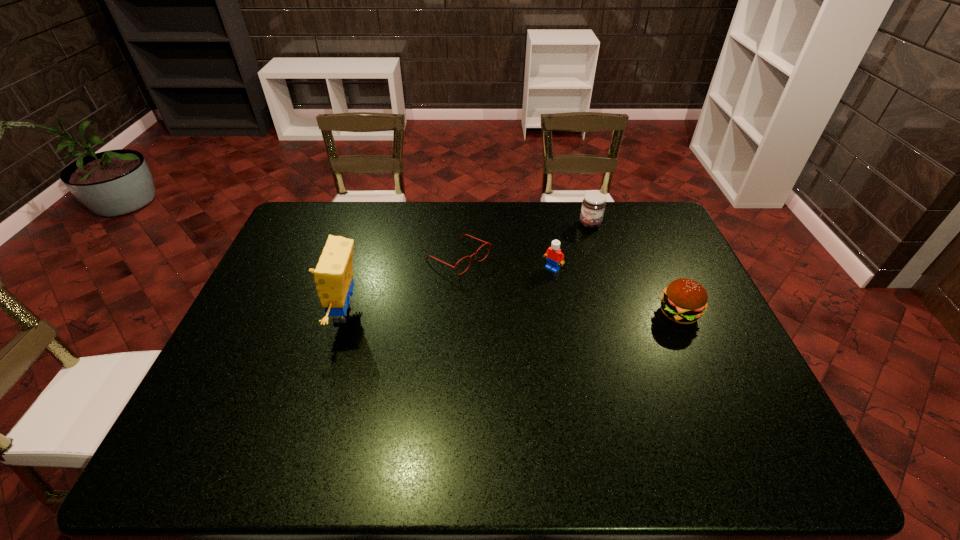
In order to click on free space located 0.350m on the face of the Lego in this screenshot , I will do `click(475, 340)`.

Identify the location of spectacles present at the far edge. The image size is (960, 540). (489, 244).

Where is `jam located at the far edge`? This screenshot has height=540, width=960. jam located at the far edge is located at coordinates (593, 205).

Locate an element on the screen. This screenshot has height=540, width=960. object that is at the right edge is located at coordinates (684, 301).

The image size is (960, 540). Find the location of `vacant space at the far edge of the desktop`. vacant space at the far edge of the desktop is located at coordinates (511, 220).

The height and width of the screenshot is (540, 960). I want to click on vacant space at the left edge, so 238,386.

Identify the location of vacant area at the right edge. (649, 262).

I want to click on vacant space at the far right corner, so click(x=633, y=222).

Image resolution: width=960 pixels, height=540 pixels. Identify the location of vacant area between the rightmost object and the farthest object. (635, 269).

At what (x,y) coordinates should I click in order to perform the action: click on empty space between the sponge and the fourth object from right to left. Please return your answer as a coordinate pair (x, y). Looking at the image, I should click on (401, 286).